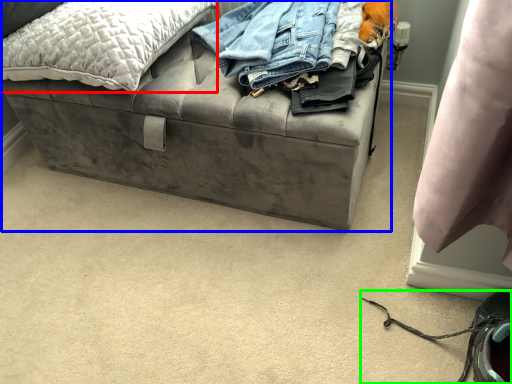
Question: Which is nearer to the pillow (highlighted by a red box)? furniture (highlighted by a blue box) or shoe (highlighted by a green box).

Choices:
 (A) furniture
 (B) shoe

Answer: (A)